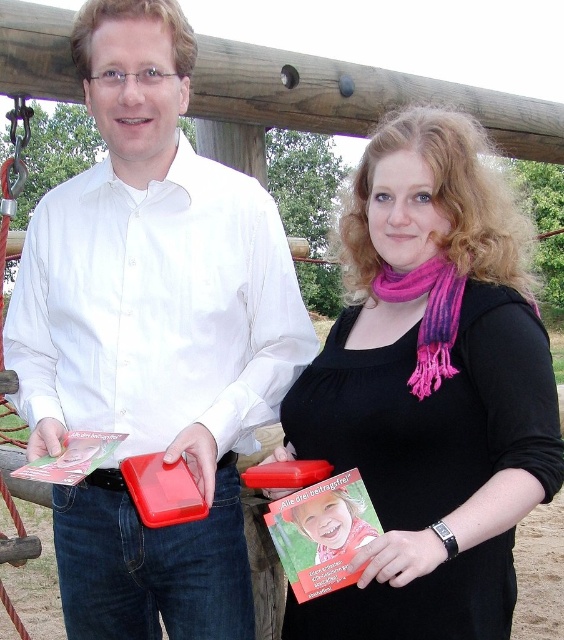
Question: Does matte plastic book at center have a greater width compared to matte black book at center?

Choices:
 (A) no
 (B) yes

Answer: (B)

Question: Which point is closer to the camera?

Choices:
 (A) (228, 353)
 (B) (512, 385)

Answer: (B)

Question: Which object is closer to the camera taking this photo?

Choices:
 (A) matte black book at center
 (B) matte plastic book at center

Answer: (A)

Question: Which point is farther to the camera?

Choices:
 (A) matte plastic book at center
 (B) matte black book at center

Answer: (A)

Question: Is matte plastic book at center closer to camera compared to matte black book at center?

Choices:
 (A) yes
 (B) no

Answer: (B)

Question: Does matte plastic book at center appear under matte black book at center?

Choices:
 (A) no
 (B) yes

Answer: (B)